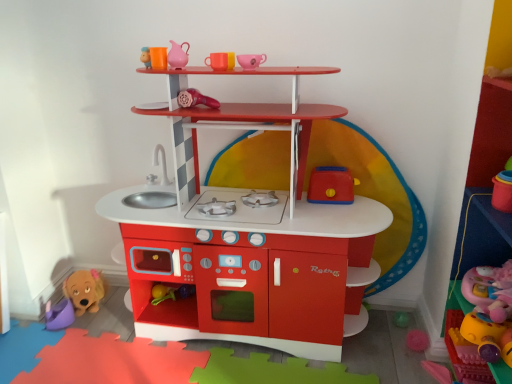
You are a GUI agent. You are given a task and a screenshot of the screen. Output one action in this format:
    pyautogui.click(x=<x>, y=<y>)
    Task: Click on the vacant space in front of purple plastic bucket at lower left, acting as the 8th toy starting from the right
    The width and height of the screenshot is (512, 384).
    Given the screenshot: What is the action you would take?
    (x=42, y=347)